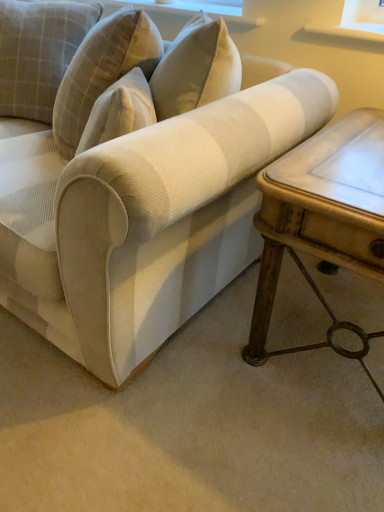
Question: Are white marble table at right and plaid fabric pillow at upper left beside each other?

Choices:
 (A) yes
 (B) no

Answer: (B)

Question: Can you confirm if white marble table at right is positioned to the right of plaid fabric pillow at upper left?

Choices:
 (A) no
 (B) yes

Answer: (B)

Question: Can you confirm if white marble table at right is smaller than plaid fabric pillow at upper left?

Choices:
 (A) no
 (B) yes

Answer: (A)

Question: Is white marble table at right completely or partially outside of plaid fabric pillow at upper left?

Choices:
 (A) yes
 (B) no

Answer: (A)

Question: Considering the relative sizes of white marble table at right and plaid fabric pillow at upper left in the image provided, is white marble table at right taller than plaid fabric pillow at upper left?

Choices:
 (A) no
 (B) yes

Answer: (B)

Question: Can you confirm if white marble table at right is thinner than plaid fabric pillow at upper left?

Choices:
 (A) no
 (B) yes

Answer: (A)

Question: Is plaid fabric pillow at upper left positioned in front of white textured fabric couch at center?

Choices:
 (A) no
 (B) yes

Answer: (A)

Question: From a real-world perspective, is plaid fabric pillow at upper left positioned over white textured fabric couch at center based on gravity?

Choices:
 (A) no
 (B) yes

Answer: (B)

Question: From the image's perspective, is plaid fabric pillow at upper left below white textured fabric couch at center?

Choices:
 (A) no
 (B) yes

Answer: (A)

Question: Is plaid fabric pillow at upper left with white textured fabric couch at center?

Choices:
 (A) yes
 (B) no

Answer: (B)

Question: Can you confirm if plaid fabric pillow at upper left is smaller than white textured fabric couch at center?

Choices:
 (A) no
 (B) yes

Answer: (B)

Question: Is plaid fabric pillow at upper left outside white textured fabric couch at center?

Choices:
 (A) yes
 (B) no

Answer: (B)

Question: Does white textured fabric couch at center lie in front of white marble table at right?

Choices:
 (A) no
 (B) yes

Answer: (B)